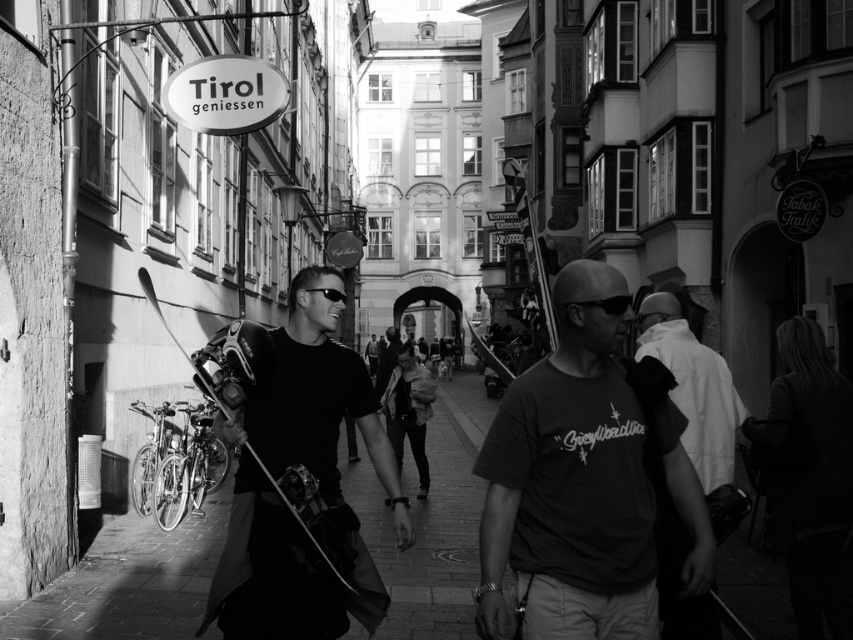
In the black and white photo of the European street scene with cobblestone pavement, there is a point marked at coordinates (432,524). What type of surface does this point indicate?

The point at (432,524) marks smooth concrete pavement at center.

You are a delivery drone that needs to land on the smooth concrete pavement at center. However, there are matte black goggles at center in the way. Can you safely land on the pavement without hitting the goggles?

The smooth concrete pavement at center might be wider than matte black goggles at center, so there could be enough space for the drone to land safely without hitting the goggles.

You are a delivery drone flying over a historic European street. You need to land on the smooth concrete pavement at center. What are the coordinates where you should land?

The coordinates for the smooth concrete pavement at center are point (432, 524).